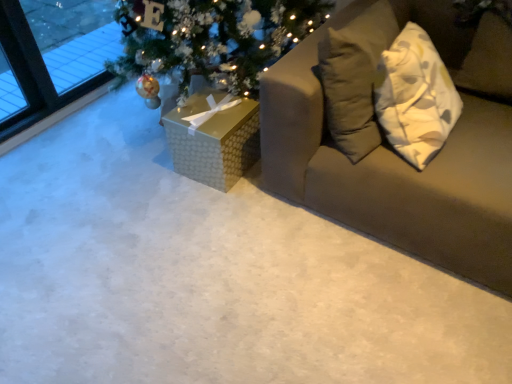
Question: Is gold textured gift box at center closer to the viewer compared to textured beige couch at right?

Choices:
 (A) no
 (B) yes

Answer: (A)

Question: From the image's perspective, is gold textured gift box at center below textured beige couch at right?

Choices:
 (A) no
 (B) yes

Answer: (B)

Question: Is textured beige couch at right surrounded by gold textured gift box at center?

Choices:
 (A) yes
 (B) no

Answer: (B)

Question: Is gold textured gift box at center oriented towards textured beige couch at right?

Choices:
 (A) no
 (B) yes

Answer: (A)

Question: Does gold textured gift box at center have a greater width compared to textured beige couch at right?

Choices:
 (A) no
 (B) yes

Answer: (A)

Question: From a real-world perspective, is gold textured gift box at center on top of textured beige couch at right?

Choices:
 (A) yes
 (B) no

Answer: (B)

Question: Considering the relative sizes of textured beige couch at right and gold textured gift box at center in the image provided, is textured beige couch at right bigger than gold textured gift box at center?

Choices:
 (A) yes
 (B) no

Answer: (A)

Question: Considering the relative sizes of textured beige couch at right and gold textured gift box at center in the image provided, is textured beige couch at right thinner than gold textured gift box at center?

Choices:
 (A) no
 (B) yes

Answer: (A)

Question: From the image's perspective, is textured beige couch at right on top of gold textured gift box at center?

Choices:
 (A) no
 (B) yes

Answer: (B)

Question: Considering the relative positions of textured beige couch at right and gold textured gift box at center in the image provided, is textured beige couch at right in front of gold textured gift box at center?

Choices:
 (A) yes
 (B) no

Answer: (A)

Question: Considering the relative sizes of textured beige couch at right and gold textured gift box at center in the image provided, is textured beige couch at right shorter than gold textured gift box at center?

Choices:
 (A) yes
 (B) no

Answer: (B)

Question: From a real-world perspective, is textured beige couch at right beneath gold textured gift box at center?

Choices:
 (A) yes
 (B) no

Answer: (B)

Question: In the image, is textured beige couch at right positioned in front of or behind gold textured gift box at center?

Choices:
 (A) front
 (B) behind

Answer: (A)